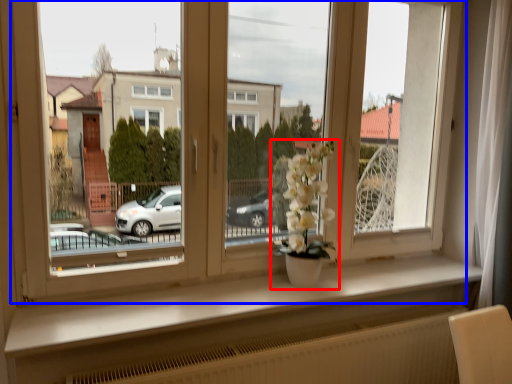
Question: Among these objects, which one is farthest to the camera, houseplant (highlighted by a red box) or window (highlighted by a blue box)?

Choices:
 (A) houseplant
 (B) window

Answer: (A)